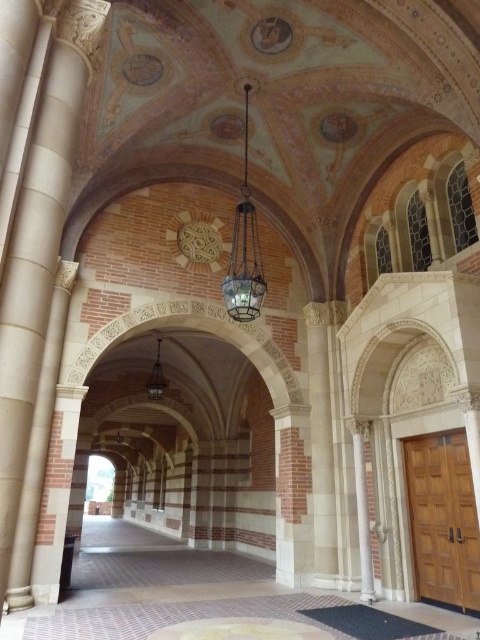
Question: Where is white marble column at center located in relation to matte brass lamp at center in the image?

Choices:
 (A) above
 (B) below

Answer: (B)

Question: Is metallic glass chandelier at center positioned in front of white marble column at center?

Choices:
 (A) no
 (B) yes

Answer: (B)

Question: Which of the following is the closest to the observer?

Choices:
 (A) (156, 356)
 (B) (363, 468)
 (C) (250, 204)

Answer: (C)

Question: Which point is farther to the camera?

Choices:
 (A) [359, 492]
 (B) [164, 381]
 (C) [257, 308]

Answer: (B)

Question: Considering the real-world distances, which object is farthest from the matte brass lamp at center?

Choices:
 (A) white marble column at center
 (B) metallic glass chandelier at center

Answer: (A)

Question: Can you confirm if metallic glass chandelier at center is smaller than white marble column at center?

Choices:
 (A) no
 (B) yes

Answer: (B)